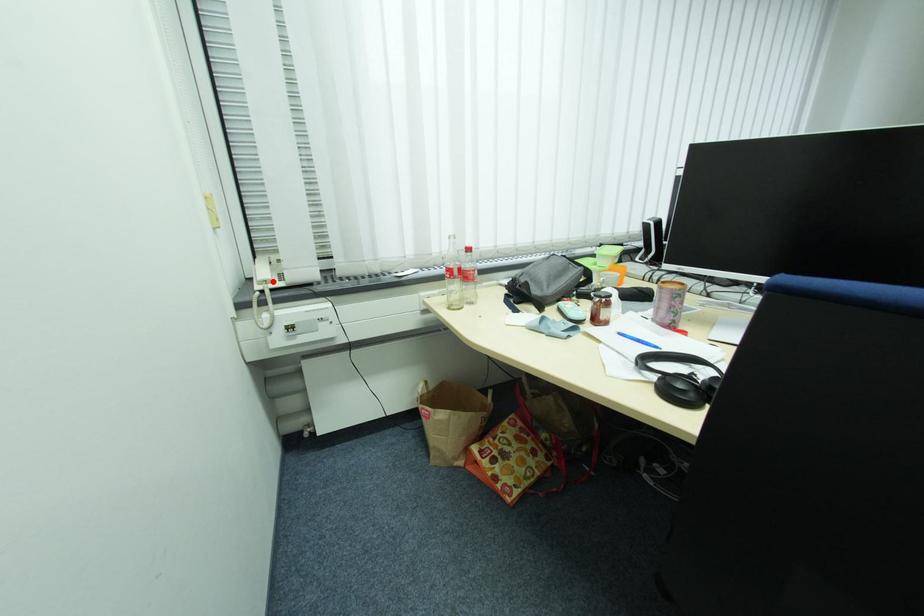
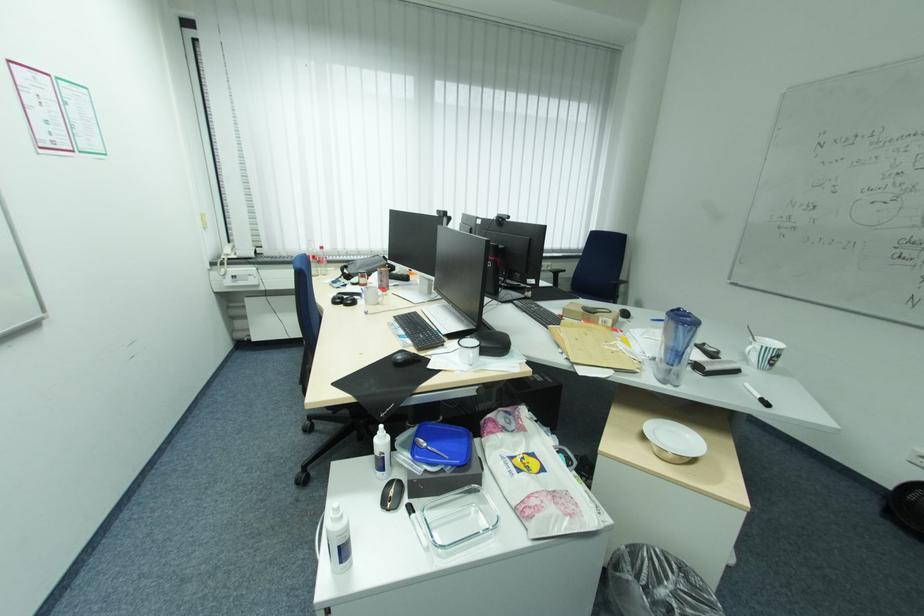
The point at the highlighted location is marked in the first image. Where is the corresponding point in the second image?

(234, 254)